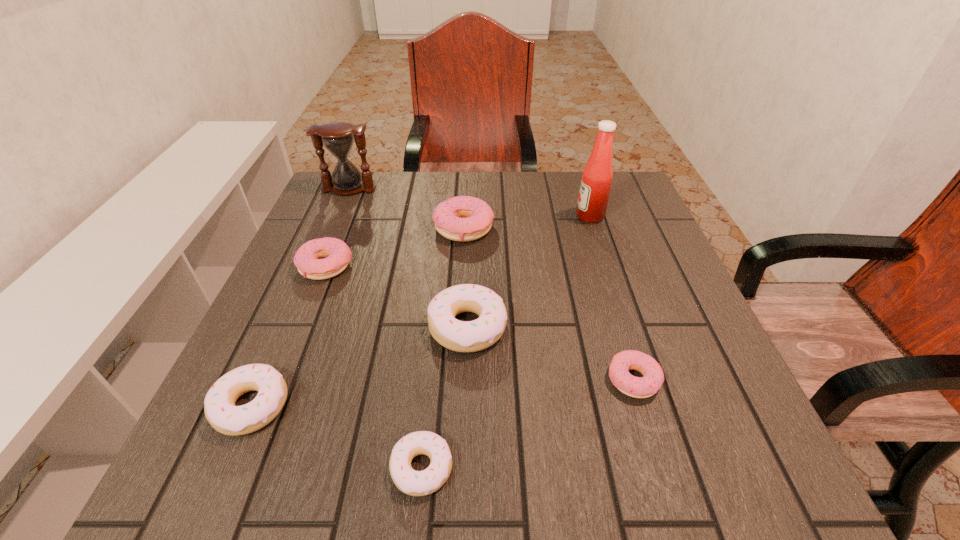
This screenshot has width=960, height=540. I want to click on condiment, so click(597, 176).

Locate an element on the screen. The height and width of the screenshot is (540, 960). red condiment is located at coordinates (597, 176).

Identify the location of hourglass. The image size is (960, 540). (338, 138).

Where is `brown hourglass`? The width and height of the screenshot is (960, 540). brown hourglass is located at coordinates (338, 138).

Identify the location of the biggest pink doughnut. (463, 218).

At what (x,y) coordinates should I click in order to perform the action: click on the farthest pink doughnut. Please return your answer as a coordinate pair (x, y). Image resolution: width=960 pixels, height=540 pixels. Looking at the image, I should click on (463, 218).

In order to click on the farthest white doughnut in this screenshot , I will do `click(470, 336)`.

You are a GUI agent. You are given a task and a screenshot of the screen. Output one action in this format:
    pyautogui.click(x=<x>, y=<y>)
    Task: Click on the fourth farthest object
    The image size is (960, 540).
    Given the screenshot: What is the action you would take?
    pyautogui.click(x=337, y=255)

You are a GUI agent. You are given a task and a screenshot of the screen. Output one action in this format:
    pyautogui.click(x=<x>, y=<y>)
    Task: Click on the fifth nearest doughnut
    The width and height of the screenshot is (960, 540).
    Given the screenshot: What is the action you would take?
    pyautogui.click(x=337, y=255)

Where is `the leftmost white doughnut`? the leftmost white doughnut is located at coordinates (219, 405).